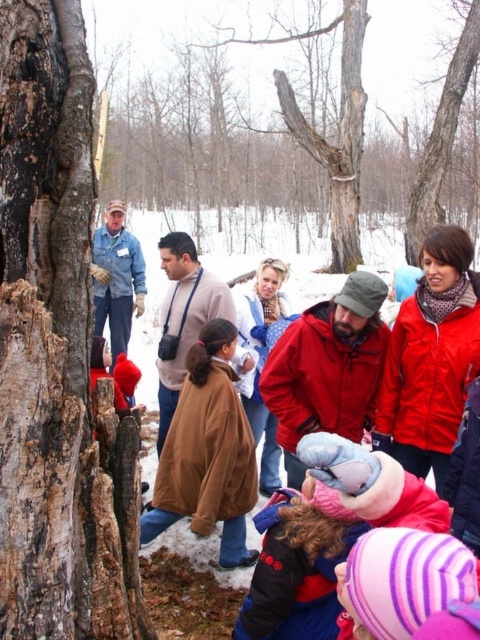
Image resolution: width=480 pixels, height=640 pixels. Identify the location of rough bark tree at center. (x=300, y=120).

Is point (323, 122) positioned after point (32, 472)?

Yes, it is.

Does point (335, 109) come in front of point (80, 145)?

No, (335, 109) is further to viewer.

Identify the location of rough bark tree at center. This screenshot has width=480, height=640. (300, 120).

Is light brown leather jacket at center shorter than smooth bark tree at center?

Yes.

Is point (186, 256) positioned after point (410, 236)?

That is False.

Locate an element on the screen. The image size is (480, 640). light brown leather jacket at center is located at coordinates (183, 317).

Locate an element on the screen. The width and height of the screenshot is (480, 640). brown rough bark tree trunk at left is located at coordinates (57, 355).

The width and height of the screenshot is (480, 640). Describe the element at coordinates (57, 355) in the screenshot. I see `brown rough bark tree trunk at left` at that location.

Find the location of a particular element. The width and height of the screenshot is (480, 640). brown rough bark tree trunk at left is located at coordinates (57, 355).